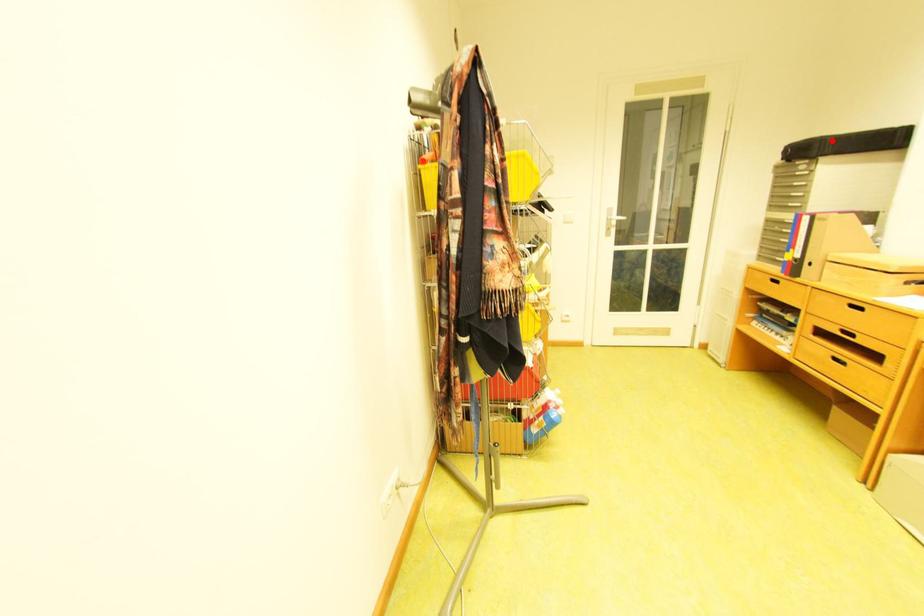
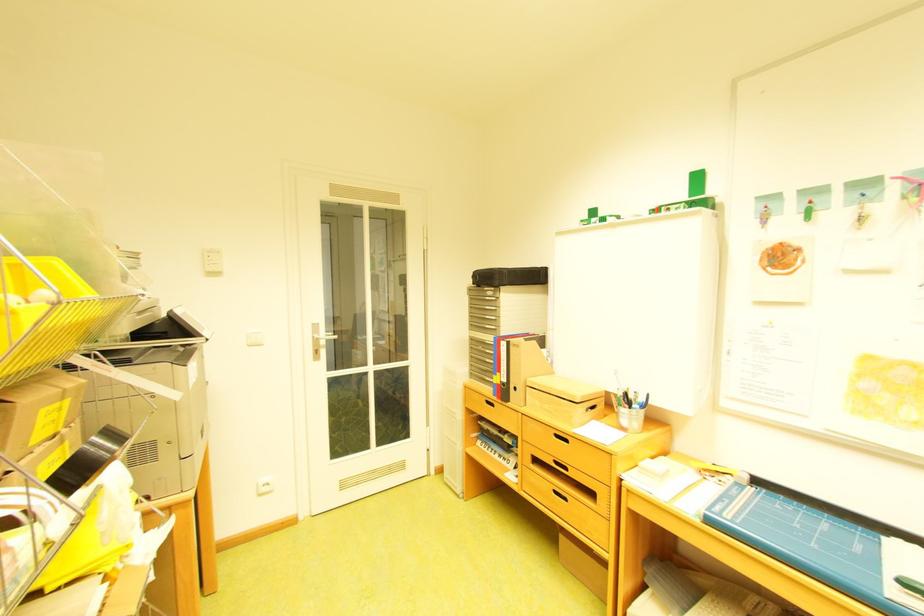
Question: I am providing you with two images of the same scene from different viewpoints. A red point is shown in image1. For the corresponding object point in image2, is it positioned nearer or farther from the camera?

Choices:
 (A) Nearer
 (B) Farther

Answer: (A)